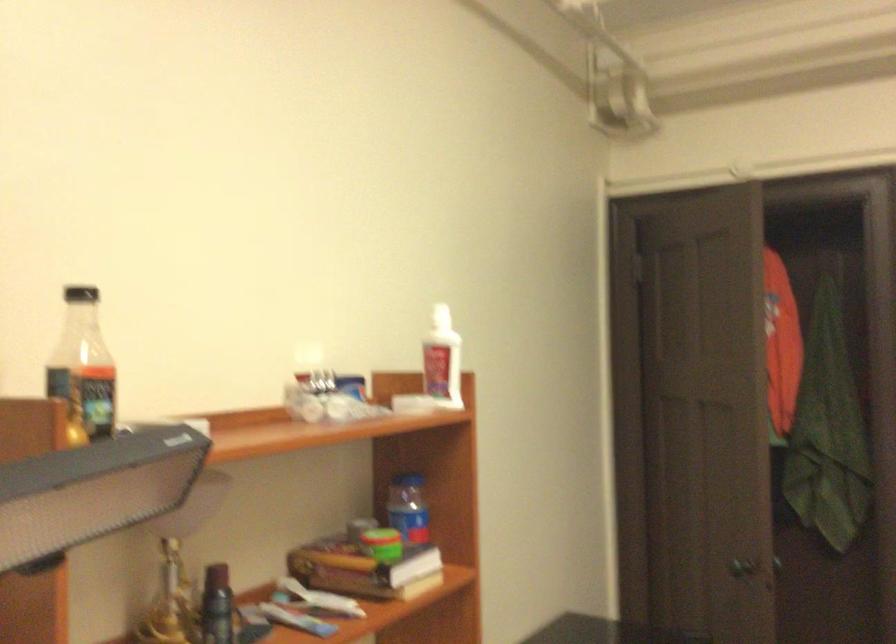
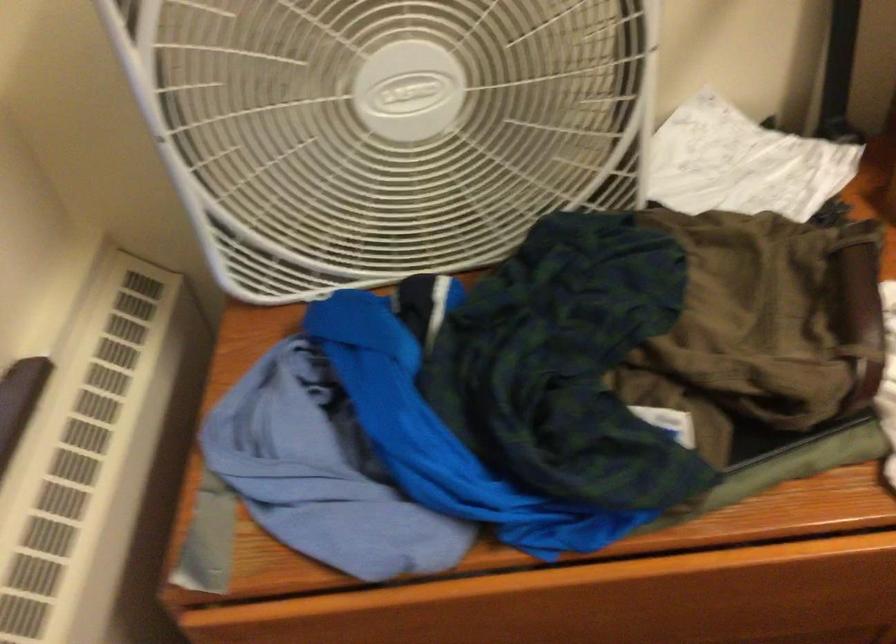
Based on the continuous images, in which direction is the camera rotating?

The rotation direction of the camera is left-down.